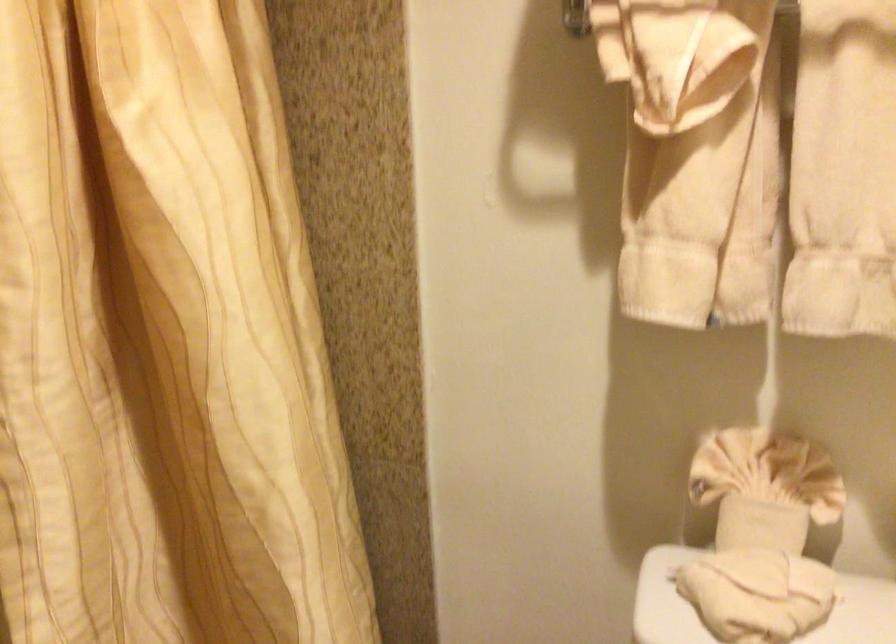
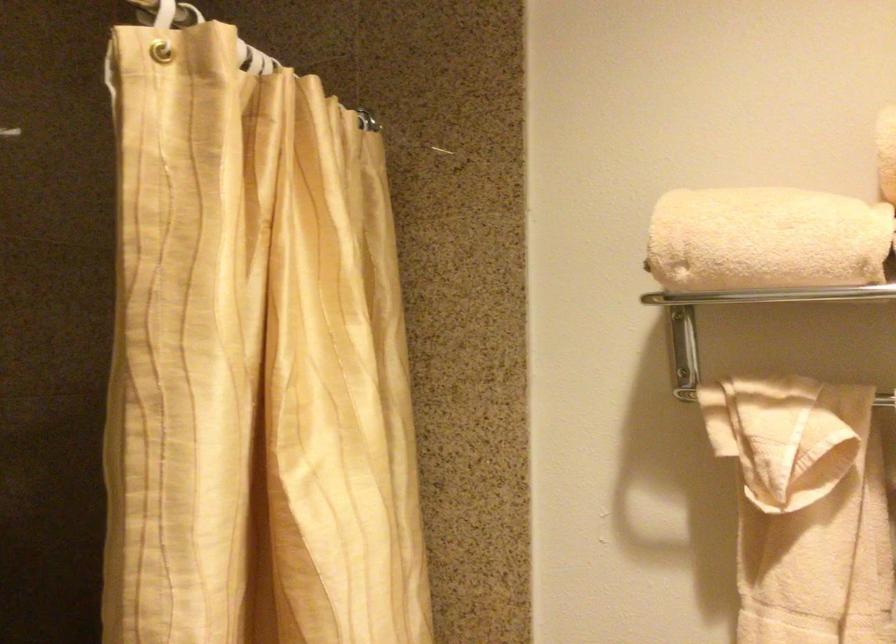
Find the pixel in the second image that matches (682,105) in the first image.

(793, 486)